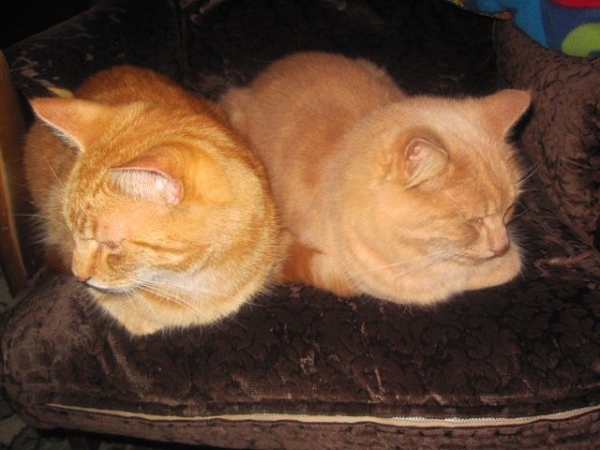
Locate an element on the screen. The height and width of the screenshot is (450, 600). backrest is located at coordinates (327, 22).